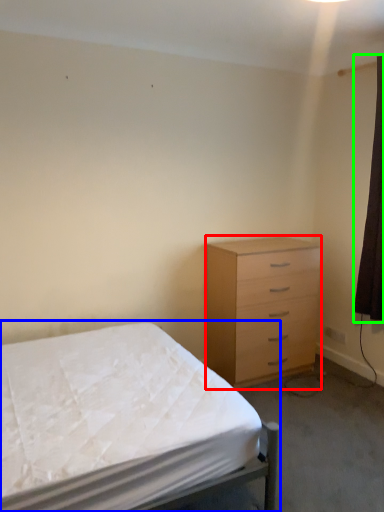
Question: Considering the real-world distances, which object is closest to chest of drawers (highlighted by a red box)? bed (highlighted by a blue box) or curtain (highlighted by a green box).

Choices:
 (A) bed
 (B) curtain

Answer: (B)